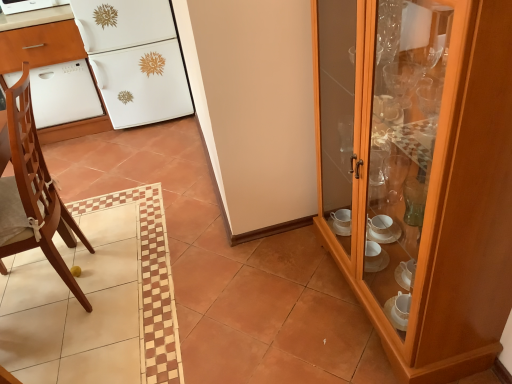
Question: Can you confirm if white glossy refrigerator at upper left is wider than white glossy oven at left?

Choices:
 (A) yes
 (B) no

Answer: (A)

Question: Is white glossy refrigerator at upper left aimed at white glossy oven at left?

Choices:
 (A) no
 (B) yes

Answer: (A)

Question: Considering the relative sizes of white glossy refrigerator at upper left and white glossy oven at left in the image provided, is white glossy refrigerator at upper left smaller than white glossy oven at left?

Choices:
 (A) yes
 (B) no

Answer: (B)

Question: Can you confirm if white glossy refrigerator at upper left is shorter than white glossy oven at left?

Choices:
 (A) yes
 (B) no

Answer: (B)

Question: Can you confirm if white glossy refrigerator at upper left is positioned to the left of white glossy oven at left?

Choices:
 (A) no
 (B) yes

Answer: (A)

Question: From the image's perspective, would you say white glossy refrigerator at upper left is shown under white glossy oven at left?

Choices:
 (A) no
 (B) yes

Answer: (A)

Question: Can you confirm if light brown wooden chair at left is thinner than white glossy dishwasher at upper left?

Choices:
 (A) no
 (B) yes

Answer: (A)

Question: Is light brown wooden chair at left facing away from white glossy dishwasher at upper left?

Choices:
 (A) no
 (B) yes

Answer: (A)

Question: Does light brown wooden chair at left have a larger size compared to white glossy dishwasher at upper left?

Choices:
 (A) no
 (B) yes

Answer: (B)

Question: Considering the relative sizes of light brown wooden chair at left and white glossy dishwasher at upper left in the image provided, is light brown wooden chair at left smaller than white glossy dishwasher at upper left?

Choices:
 (A) no
 (B) yes

Answer: (A)

Question: Is light brown wooden chair at left further to the viewer compared to white glossy dishwasher at upper left?

Choices:
 (A) no
 (B) yes

Answer: (A)

Question: Is white glossy dishwasher at upper left surrounded by light brown wooden chair at left?

Choices:
 (A) yes
 (B) no

Answer: (B)

Question: From the image's perspective, is white glossy dishwasher at left under light brown wooden chair at left?

Choices:
 (A) yes
 (B) no

Answer: (B)